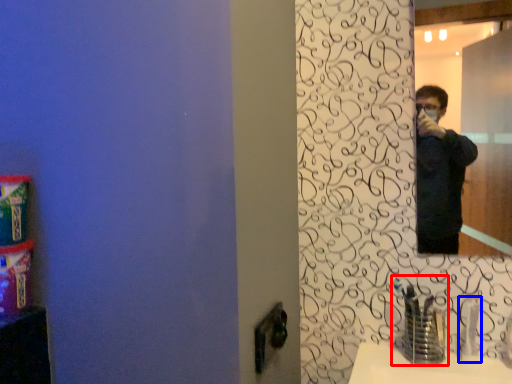
Question: Which object is further to the camera taking this photo, faucet (highlighted by a red box) or faucet (highlighted by a blue box)?

Choices:
 (A) faucet
 (B) faucet

Answer: (B)